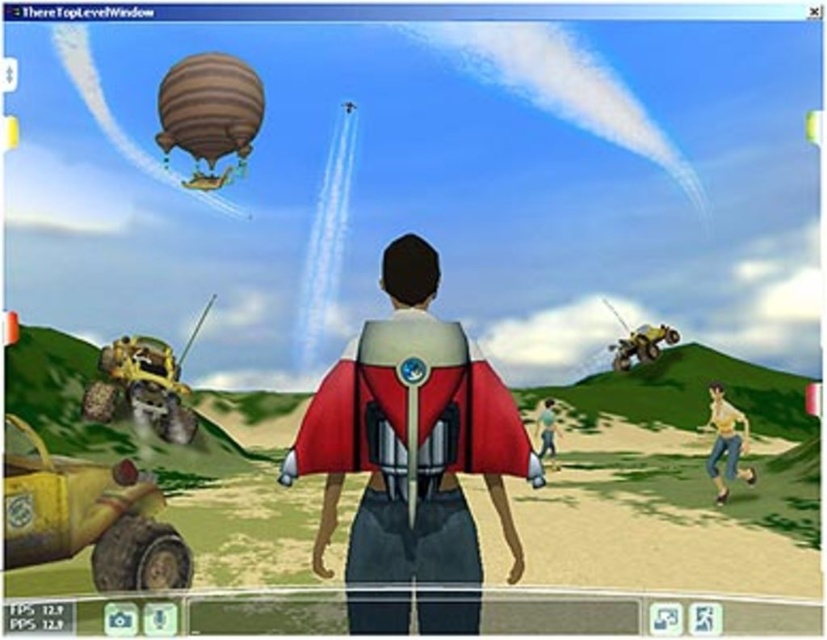
Between shiny metallic jetpack at center and striped fabric hot air balloon at upper left, which one appears on the left side from the viewer's perspective?

From the viewer's perspective, striped fabric hot air balloon at upper left appears more on the left side.

Describe the element at coordinates (414, 448) in the screenshot. I see `shiny metallic jetpack at center` at that location.

Locate an element on the screen. The width and height of the screenshot is (827, 640). shiny metallic jetpack at center is located at coordinates (414, 448).

The width and height of the screenshot is (827, 640). What do you see at coordinates (209, 108) in the screenshot?
I see `striped fabric hot air balloon at upper left` at bounding box center [209, 108].

The height and width of the screenshot is (640, 827). Find the location of `striped fabric hot air balloon at upper left`. striped fabric hot air balloon at upper left is located at coordinates (209, 108).

Does shiny metallic jetpack at center appear on the left side of skinny jeans at lower right?

Correct, you'll find shiny metallic jetpack at center to the left of skinny jeans at lower right.

You are a GUI agent. You are given a task and a screenshot of the screen. Output one action in this format:
    pyautogui.click(x=<x>, y=<y>)
    Task: Click on the shiny metallic jetpack at center
    This screenshot has height=640, width=827.
    Given the screenshot: What is the action you would take?
    pyautogui.click(x=414, y=448)